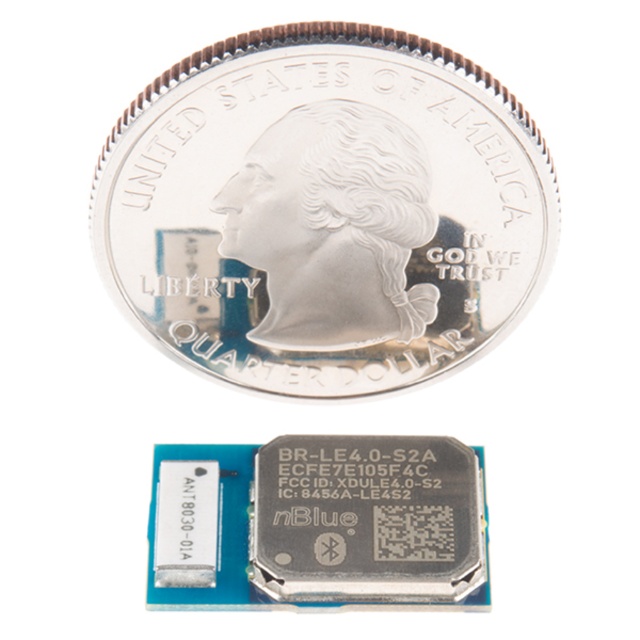
Question: Is silver metallic coin at center positioned behind silver metallic coin at upper center?

Choices:
 (A) yes
 (B) no

Answer: (B)

Question: Which of the following is the closest to the observer?

Choices:
 (A) coord(266,566)
 (B) coord(358,168)

Answer: (B)

Question: Among these points, which one is farthest from the camera?

Choices:
 (A) (336, 221)
 (B) (275, 461)

Answer: (B)

Question: Can you confirm if silver metallic coin at center is positioned to the right of silver metallic coin at upper center?

Choices:
 (A) no
 (B) yes

Answer: (A)

Question: Can you confirm if silver metallic coin at center is positioned to the right of silver metallic coin at upper center?

Choices:
 (A) yes
 (B) no

Answer: (B)